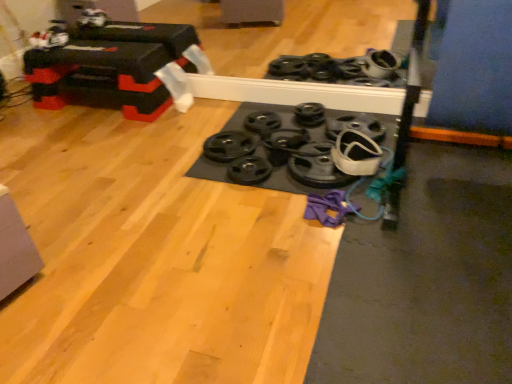
Question: Do you think black rubber weight plate at center, the 4th wheel viewed from the right, is within black rubber weight plate at center, the second wheel in the left-to-right sequence, or outside of it?

Choices:
 (A) inside
 (B) outside

Answer: (B)

Question: Is black rubber weight plate at center, the 4th wheel viewed from the right, taller or shorter than black rubber weight plate at center, positioned as the 5th wheel in right-to-left order?

Choices:
 (A) short
 (B) tall

Answer: (B)

Question: Based on their relative distances, which object is nearer to the black rubber weight plate at center, placed as the 1th wheel when sorted from right to left?

Choices:
 (A) black rubber weight plate at center, which appears as the 3th wheel when viewed from the right
 (B) black rubber weight plate at center, acting as the 2th wheel starting from the right
 (C) black rubber weight plate at center, positioned as the 5th wheel in right-to-left order
 (D) black rubber weight plate at center, the 3th wheel viewed from the left
 (E) black rubber weights at center, the sixth wheel positioned from the right

Answer: (A)

Question: Estimate the real-world distances between objects in this image. Which object is closer to the black rubber weight plate at center, the 3th wheel viewed from the left?

Choices:
 (A) black rubber weight plate at center, the fifth wheel in the left-to-right sequence
 (B) black rubber weights at center, the sixth wheel positioned from the right
 (C) black rubber weight plate at center, the second wheel in the left-to-right sequence
 (D) black rubber weight plate at center, placed as the 1th wheel when sorted from right to left
 (E) black rubber weight plate at center, which appears as the 3th wheel when viewed from the right

Answer: (C)